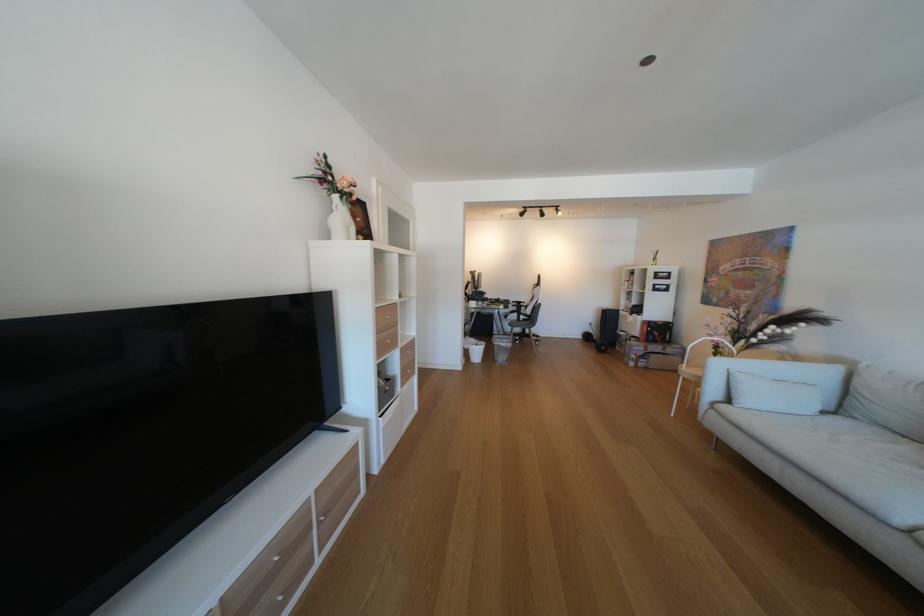
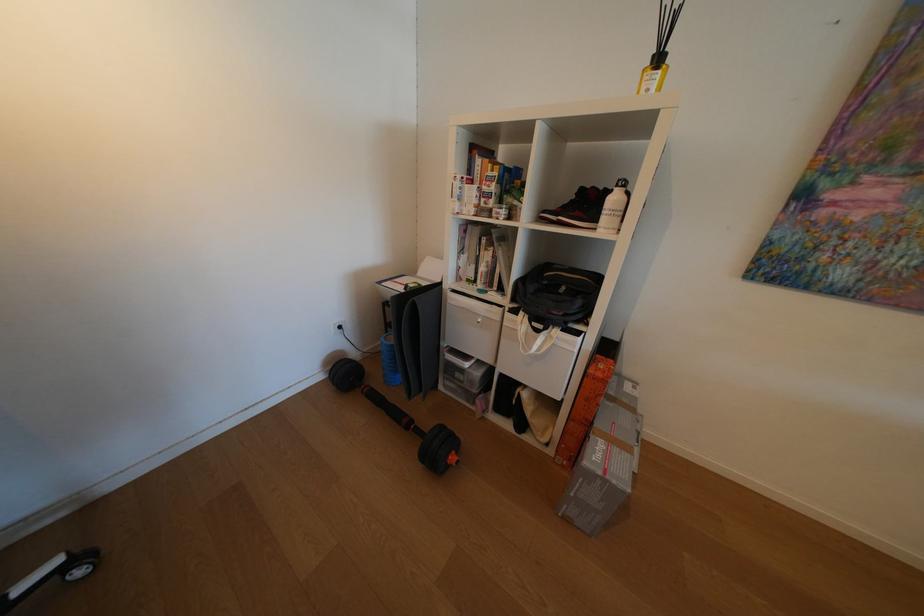
The point at (641, 315) is marked in the first image. Where is the corresponding point in the second image?

(548, 331)